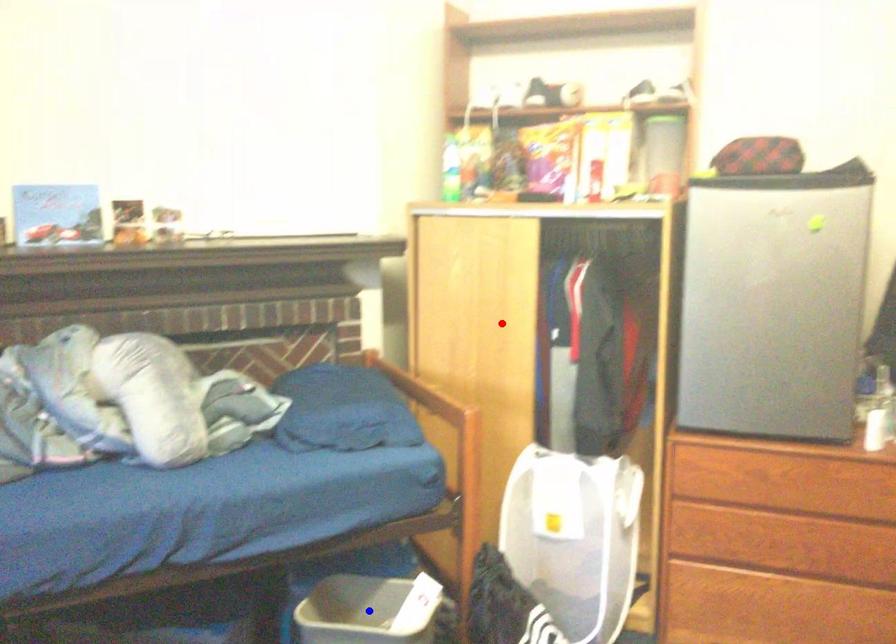
Question: Which of the two points in the image is closer to the camera?

Choices:
 (A) Blue point is closer.
 (B) Red point is closer.

Answer: (A)